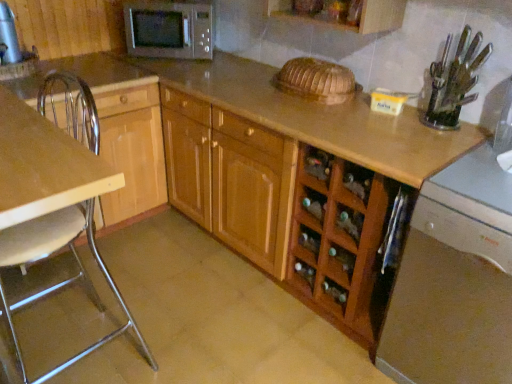
Question: In the image, is clear plastic knife block at upper right, the 2th appliance in the top-to-bottom sequence, on the left side or the right side of satin silver microwave at upper center?

Choices:
 (A) right
 (B) left

Answer: (A)

Question: Considering the positions of point (431, 81) and point (177, 8), is point (431, 81) closer or farther from the camera than point (177, 8)?

Choices:
 (A) closer
 (B) farther

Answer: (A)

Question: Estimate the real-world distances between objects in this image. Which object is closer to the wooden cabinet at center, placed as the first cabinetry when sorted from right to left?

Choices:
 (A) satin silver microwave at upper center
 (B) clear plastic knife block at upper right, marked as the second appliance in a left-to-right arrangement
 (C) satin silver dishwasher at lower right
 (D) metallic silver chair at left
 (E) wooden cabinet at left, the 1th cabinetry positioned from the left

Answer: (C)

Question: Estimate the real-world distances between objects in this image. Which object is farther from the brushed metal water heater at upper left, which is the second appliance in front-to-back order?

Choices:
 (A) satin silver microwave at upper center
 (B) clear plastic knife block at upper right, the first appliance in the right-to-left sequence
 (C) satin silver dishwasher at lower right
 (D) wooden cabinet at left, the 1th cabinetry positioned from the left
 (E) metallic silver chair at left

Answer: (C)